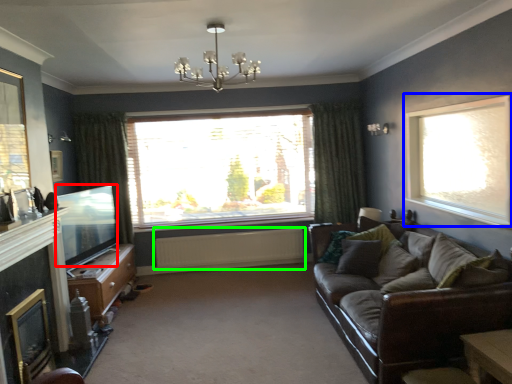
Question: Considering the real-world distances, which object is closest to window screen (highlighted by a red box)? window (highlighted by a blue box) or radiator (highlighted by a green box).

Choices:
 (A) window
 (B) radiator

Answer: (B)